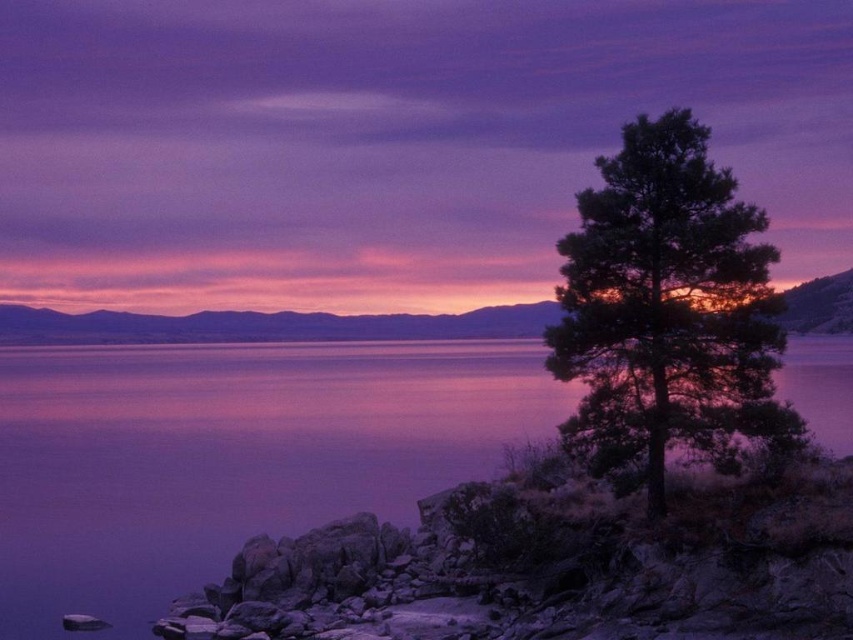
Question: Does purple smooth water at center have a greater width compared to dark green textured tree at right?

Choices:
 (A) yes
 (B) no

Answer: (A)

Question: Can you confirm if purple smooth water at center is positioned above dark green textured tree at right?

Choices:
 (A) yes
 (B) no

Answer: (B)

Question: Which of the following is the closest to the observer?

Choices:
 (A) dark green textured tree at right
 (B) purple smooth water at center

Answer: (A)

Question: Is purple smooth water at center closer to the viewer compared to dark green textured tree at right?

Choices:
 (A) no
 (B) yes

Answer: (A)

Question: Which point is farther from the camera taking this photo?

Choices:
 (A) (474, 429)
 (B) (579, 237)

Answer: (A)